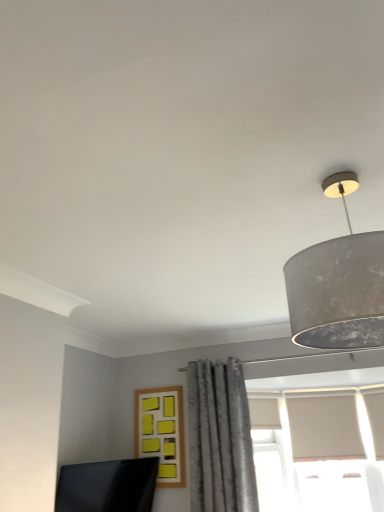
Question: Is gray textured curtain at center in contact with matte black monitor at lower left?

Choices:
 (A) yes
 (B) no

Answer: (B)

Question: Does gray textured curtain at center appear on the left side of matte black monitor at lower left?

Choices:
 (A) no
 (B) yes

Answer: (A)

Question: Does gray textured curtain at center have a lesser height compared to matte black monitor at lower left?

Choices:
 (A) yes
 (B) no

Answer: (B)

Question: From a real-world perspective, is gray textured curtain at center under matte black monitor at lower left?

Choices:
 (A) no
 (B) yes

Answer: (A)

Question: Does gray textured curtain at center have a greater width compared to matte black monitor at lower left?

Choices:
 (A) yes
 (B) no

Answer: (A)

Question: Would you say matte black monitor at lower left is inside or outside gray textured curtain at center?

Choices:
 (A) inside
 (B) outside

Answer: (B)

Question: In the image, is matte black monitor at lower left positioned in front of or behind gray textured curtain at center?

Choices:
 (A) front
 (B) behind

Answer: (A)

Question: Is matte black monitor at lower left bigger or smaller than gray textured curtain at center?

Choices:
 (A) small
 (B) big

Answer: (A)

Question: Is matte black monitor at lower left taller or shorter than gray textured curtain at center?

Choices:
 (A) short
 (B) tall

Answer: (A)

Question: Is matte gray lampshade at upper right taller or shorter than matte black monitor at lower left?

Choices:
 (A) tall
 (B) short

Answer: (A)

Question: From the image's perspective, relative to matte black monitor at lower left, is matte gray lampshade at upper right above or below?

Choices:
 (A) above
 (B) below

Answer: (A)

Question: Choose the correct answer: Is matte gray lampshade at upper right inside matte black monitor at lower left or outside it?

Choices:
 (A) inside
 (B) outside

Answer: (B)

Question: Considering the positions of matte gray lampshade at upper right and matte black monitor at lower left in the image, is matte gray lampshade at upper right bigger or smaller than matte black monitor at lower left?

Choices:
 (A) big
 (B) small

Answer: (A)

Question: Does point (170, 465) appear closer or farther from the camera than point (147, 495)?

Choices:
 (A) farther
 (B) closer

Answer: (A)

Question: From the image's perspective, is yellow matte frame at center above or below matte black monitor at lower left?

Choices:
 (A) below
 (B) above

Answer: (B)